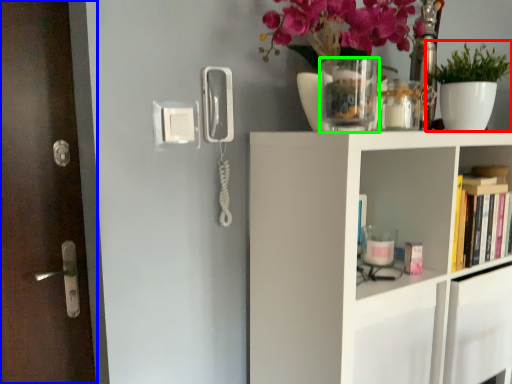
Question: Considering the real-world distances, which object is closest to houseplant (highlighted by a red box)? door (highlighted by a blue box) or vase (highlighted by a green box).

Choices:
 (A) door
 (B) vase

Answer: (B)